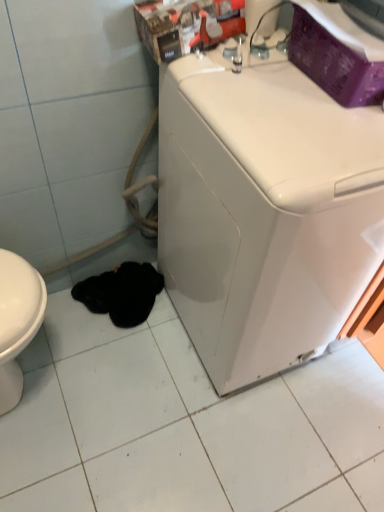
Identify the location of free spot in front of white glossy washing machine at center. (229, 435).